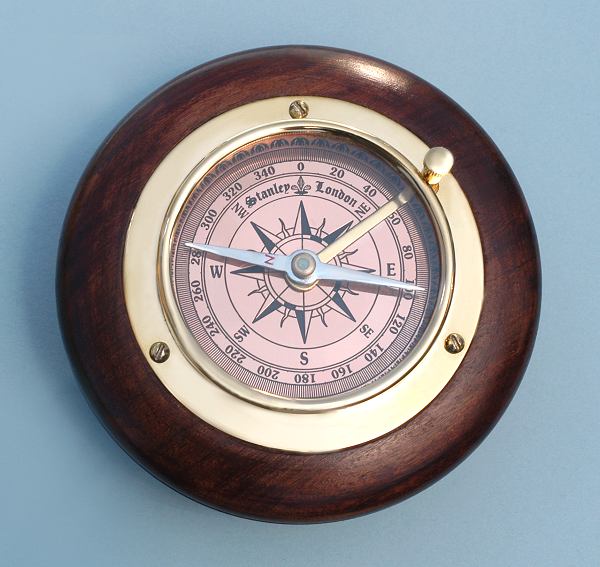
You are a GUI agent. You are given a task and a screenshot of the screen. Output one action in this format:
    pyautogui.click(x=<x>, y=<y>)
    Task: Click on the shadow on wall
    The height and width of the screenshot is (567, 600).
    Given the screenshot: What is the action you would take?
    pyautogui.click(x=43, y=249)